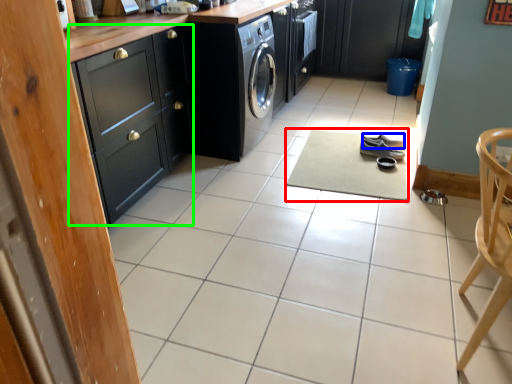
Question: Which is nearer to the wide (highlighted by a red box)? footwear (highlighted by a blue box) or cabinetry (highlighted by a green box).

Choices:
 (A) footwear
 (B) cabinetry

Answer: (A)